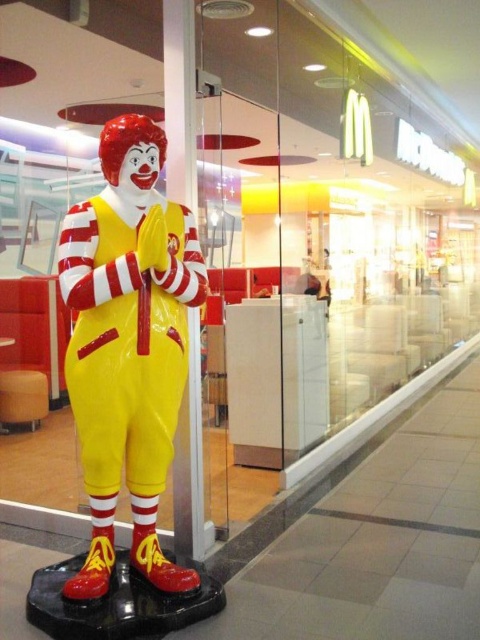
Image resolution: width=480 pixels, height=640 pixels. What do you see at coordinates (129, 346) in the screenshot? I see `shiny plastic clown at center` at bounding box center [129, 346].

Which is below, shiny plastic clown at center or wooden stool at lower left?

wooden stool at lower left

Is point (92, 419) positioned in front of point (19, 413)?

Yes.

Locate an element on the screen. This screenshot has width=480, height=640. shiny plastic clown at center is located at coordinates (129, 346).